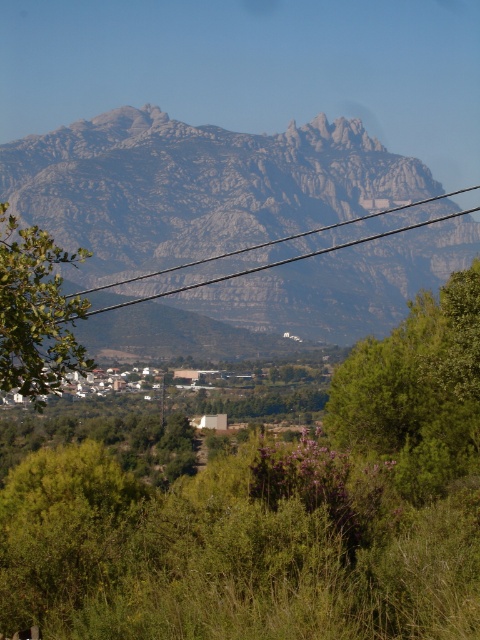
You are standing at the base of the mountain and looking towards the green leafy tree at center and the green leafy tree at lower left. Which tree is closer to you?

The green leafy tree at lower left is closer to you because it is positioned lower in the image, which typically indicates proximity in such landscapes.

You are standing at the point closer to the camera between point (403, 337) and point (49, 346). Which point are you at?

You are at point (49, 346) because it is closer to the camera than point (403, 337).

You are a bird looking for a place to perch. You see a green leafy tree at center and a black wire at upper center. Which object would allow you to perch higher above the ground?

The black wire at upper center is higher because the green leafy tree at center is positioned under it.